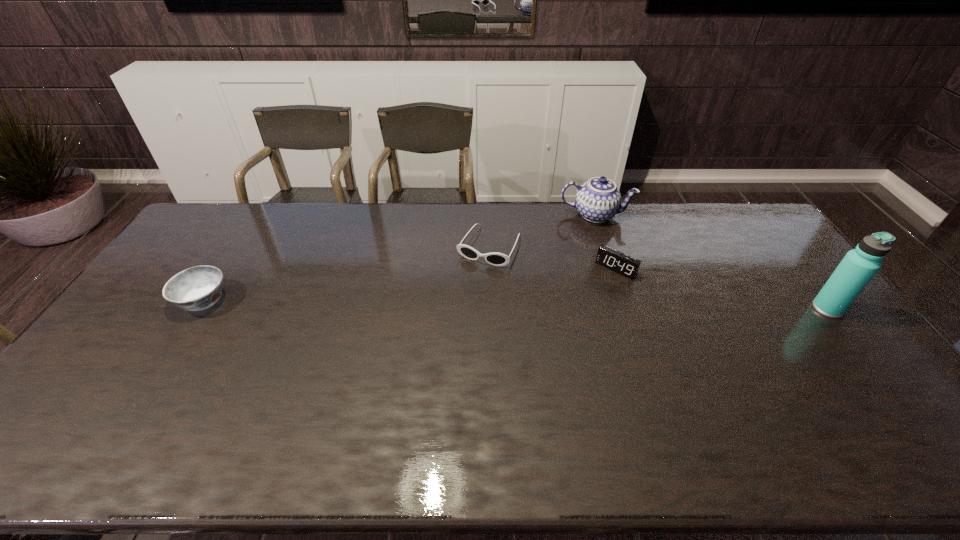
What are the coordinates of `free spot between the thermos bottle and the ashtray` in the screenshot? It's located at (516, 305).

I want to click on free spot between the ashtray and the fourth shortest object, so click(x=399, y=258).

Find the location of a particular element. The height and width of the screenshot is (540, 960). vacant area that lies between the sunglasses and the alarm clock is located at coordinates (553, 258).

Find the location of a particular element. vacant area that lies between the thermos bottle and the ashtray is located at coordinates (516, 305).

Locate an element on the screen. This screenshot has height=540, width=960. vacant space that's between the leftmost object and the chinaware is located at coordinates (399, 258).

At what (x,y) coordinates should I click in order to perform the action: click on the third closest object to the ashtray. Please return your answer as a coordinate pair (x, y). This screenshot has height=540, width=960. Looking at the image, I should click on (623, 264).

Identify the location of object that is the nearest to the sunglasses. (597, 200).

What are the coordinates of `vacant point that satisfies the following two spatial constraints: 1. on the back side of the ashtray; 2. on the right side of the alarm clock` in the screenshot? It's located at (224, 269).